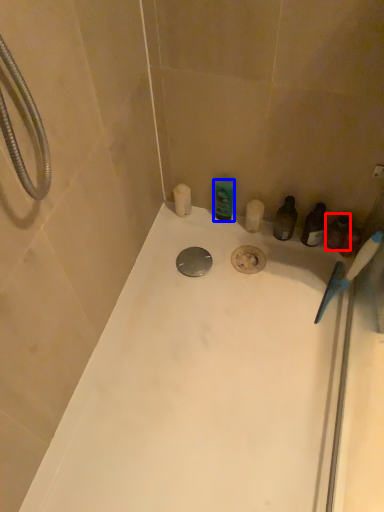
Question: Among these objects, which one is farthest to the camera, toiletry (highlighted by a red box) or toiletry (highlighted by a blue box)?

Choices:
 (A) toiletry
 (B) toiletry

Answer: (B)